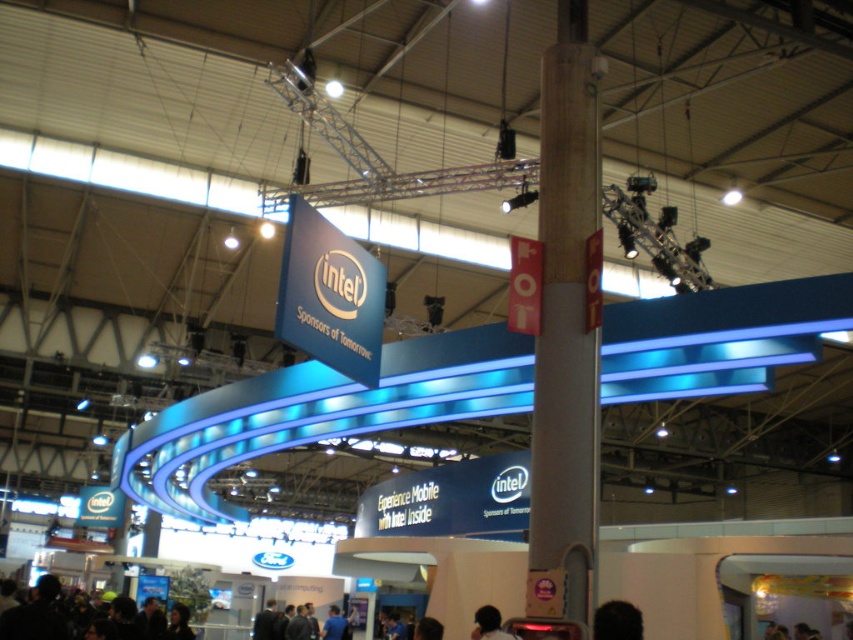
Question: Among these points, which one is farthest from the camera?

Choices:
 (A) (553, 186)
 (B) (497, 632)

Answer: (A)

Question: Does dark hair at lower center appear on the left side of dark brown hair at lower center?

Choices:
 (A) yes
 (B) no

Answer: (B)

Question: Which of the following is the closest to the observer?

Choices:
 (A) dark brown hair at lower center
 (B) dark hair at lower center
 (C) wooden pole at center

Answer: (B)

Question: Does wooden pole at center have a larger size compared to dark brown hair at lower center?

Choices:
 (A) no
 (B) yes

Answer: (A)

Question: Does wooden pole at center have a smaller size compared to dark hair at lower center?

Choices:
 (A) no
 (B) yes

Answer: (B)

Question: Which point is closer to the camera?

Choices:
 (A) (473, 636)
 (B) (634, 624)
 (C) (569, 230)

Answer: (B)